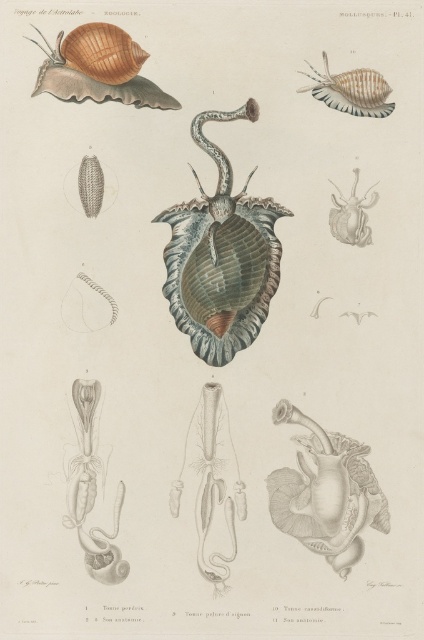
Based on the illustration labeled Voyage de lAstralabe Zoologie, which shell is wider, the shiny metallic shell at center or the matte brown shell at upper left?

The matte brown shell at upper left is wider than the shiny metallic shell at center.

You are a marine biologist preparing to present a lecture on mollusk morphology. You have a slide showing this image. If you want to highlight the distance between the shiny metallic shell at center and the shiny beige shell at upper right, what would you tell your audience about their separation?

The shiny metallic shell at center and the shiny beige shell at upper right are 6.30 inches apart.